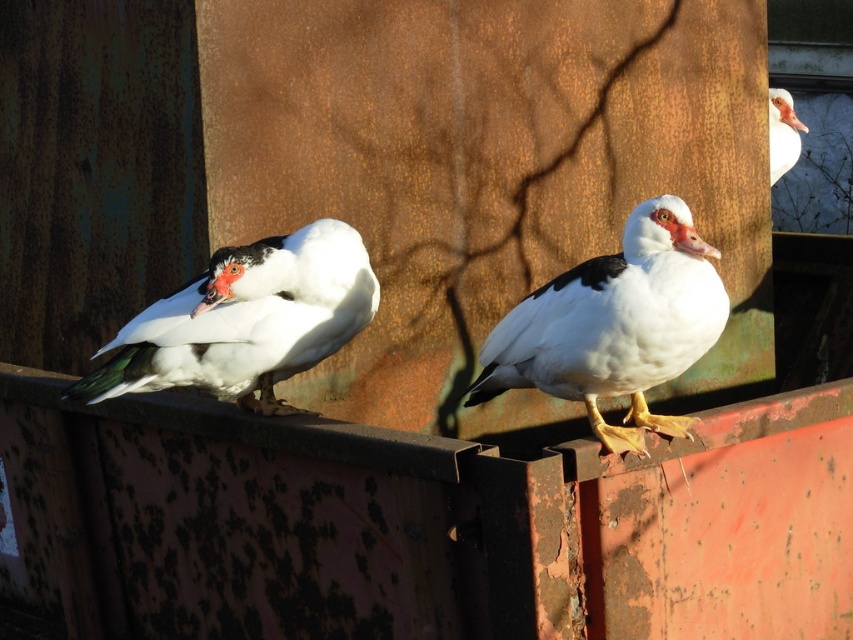
Who is more distant from viewer, (651, 259) or (218, 278)?

Point (218, 278)

Looking at this image, which is more to the right, white matte duck at center or white matte duck at left?

white matte duck at center is more to the right.

The width and height of the screenshot is (853, 640). Describe the element at coordinates (614, 324) in the screenshot. I see `white matte duck at center` at that location.

You are a GUI agent. You are given a task and a screenshot of the screen. Output one action in this format:
    pyautogui.click(x=<x>, y=<y>)
    Task: Click on the white matte duck at center
    The image size is (853, 640).
    Given the screenshot: What is the action you would take?
    click(x=614, y=324)

Is white matte duck at center thinner than white matte duck at upper right?

No.

Can you confirm if white matte duck at center is taller than white matte duck at upper right?

Yes, white matte duck at center is taller than white matte duck at upper right.

Identify the location of white matte duck at center. (614, 324).

Which of these two, white matte duck at left or white matte duck at upper right, stands taller?

Standing taller between the two is white matte duck at left.

Is point (310, 243) positioned after point (776, 163)?

That is False.

Image resolution: width=853 pixels, height=640 pixels. I want to click on white matte duck at left, so [247, 321].